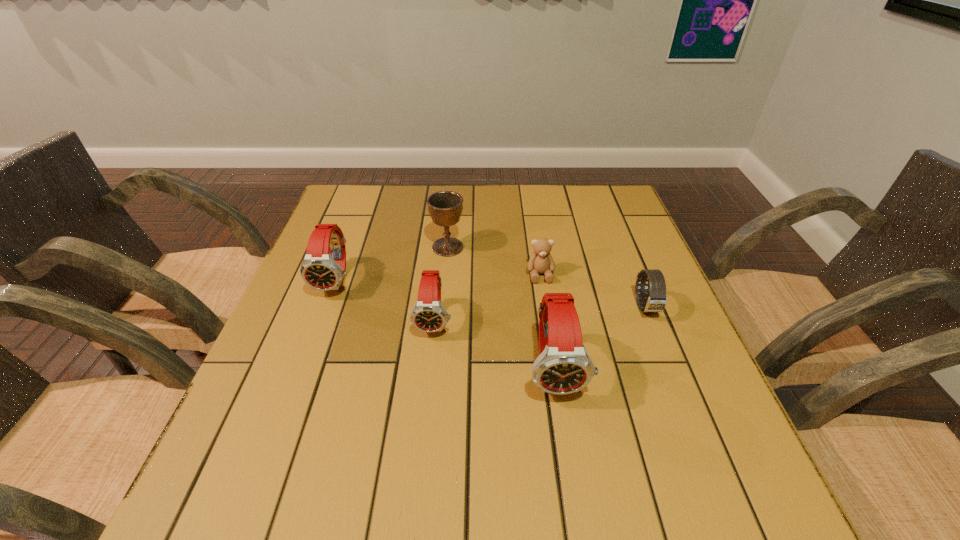
The width and height of the screenshot is (960, 540). I want to click on vacant area situated on the face of the second watch from left to right, so click(x=428, y=381).

Where is `vacant region located 0.070m on the face of the third watch from left to right`? The width and height of the screenshot is (960, 540). vacant region located 0.070m on the face of the third watch from left to right is located at coordinates (566, 443).

I want to click on free space located on the face of the teddy bear, so point(550,338).

Locate an element on the screen. Image resolution: width=960 pixels, height=540 pixels. free space located 0.140m on the face of the shortest watch is located at coordinates (672, 374).

You are a GUI agent. You are given a task and a screenshot of the screen. Output one action in this format:
    pyautogui.click(x=<x>, y=<y>)
    Task: Click on the free space located on the right of the farthest object
    
    Given the screenshot: What is the action you would take?
    pyautogui.click(x=610, y=247)

The width and height of the screenshot is (960, 540). In order to click on object at the left edge in this screenshot , I will do `click(320, 270)`.

You are a GUI agent. You are given a task and a screenshot of the screen. Output one action in this format:
    pyautogui.click(x=<x>, y=<y>)
    Task: Click on the object that is at the right edge
    This screenshot has height=540, width=960.
    Given the screenshot: What is the action you would take?
    pyautogui.click(x=656, y=300)

Image resolution: width=960 pixels, height=540 pixels. I want to click on free point at the far edge, so click(393, 226).

Locate an element on the screen. This screenshot has width=960, height=540. free space at the near edge is located at coordinates (345, 414).

In the image, there is a desktop. At what (x,y) coordinates should I click in order to perform the action: click on vacant space at the left edge. Please return your answer as a coordinate pair (x, y). This screenshot has width=960, height=540. Looking at the image, I should click on (324, 326).